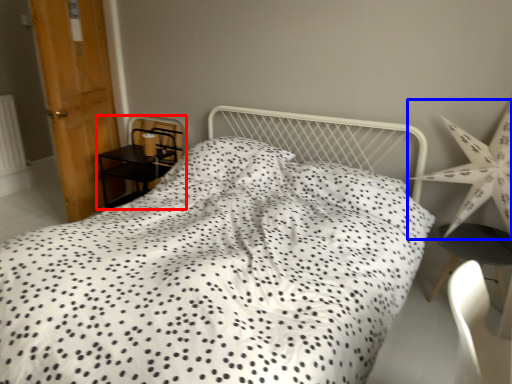
Question: Which of the following is the closest to the observer, furniture (highlighted by a red box) or star (highlighted by a blue box)?

Choices:
 (A) furniture
 (B) star

Answer: (B)